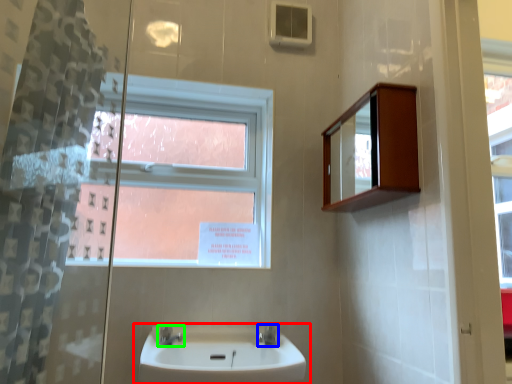
Question: Which object is the closest to the sink (highlighted by a red box)? Choose among these: tap (highlighted by a blue box) or tap (highlighted by a green box).

Choices:
 (A) tap
 (B) tap

Answer: (B)